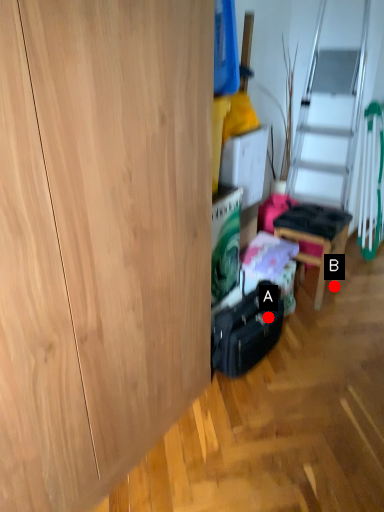
Question: Two points are circled on the image, labeled by A and B beside each circle. Which point is farther from the camera taking this photo?

Choices:
 (A) A is further
 (B) B is further

Answer: (B)